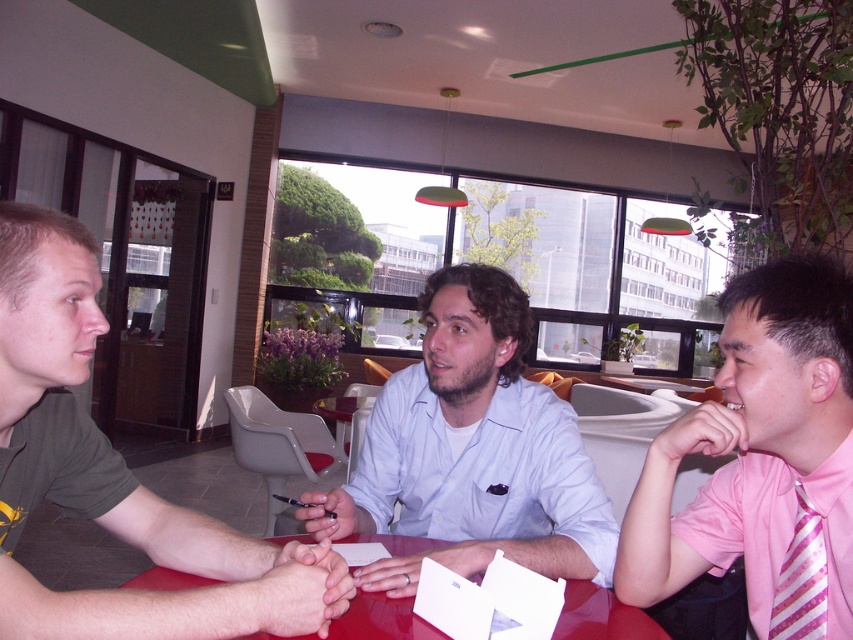
You are taking a photo of the scene and want to focus on both the point at coordinates point (x=44, y=305) and point (x=769, y=627). Which point should you adjust your focus to first to ensure both are in sharp focus?

You should focus on point (x=44, y=305) first because it is closer to the camera than point (x=769, y=627). This ensures that when adjusting focus, starting from the closer point allows for better depth of field coverage for both points.

You are standing at the entrance of the room and want to greet the person wearing the pink striped tie at right. Based on their position in the room, in which direction should you walk to reach them?

The pink striped tie at right is located at point 0.719 on the x axis and 0.893 on the y axis. Since you are at the entrance, you should walk towards the right side of the room and slightly forward to reach the pink striped tie at right.